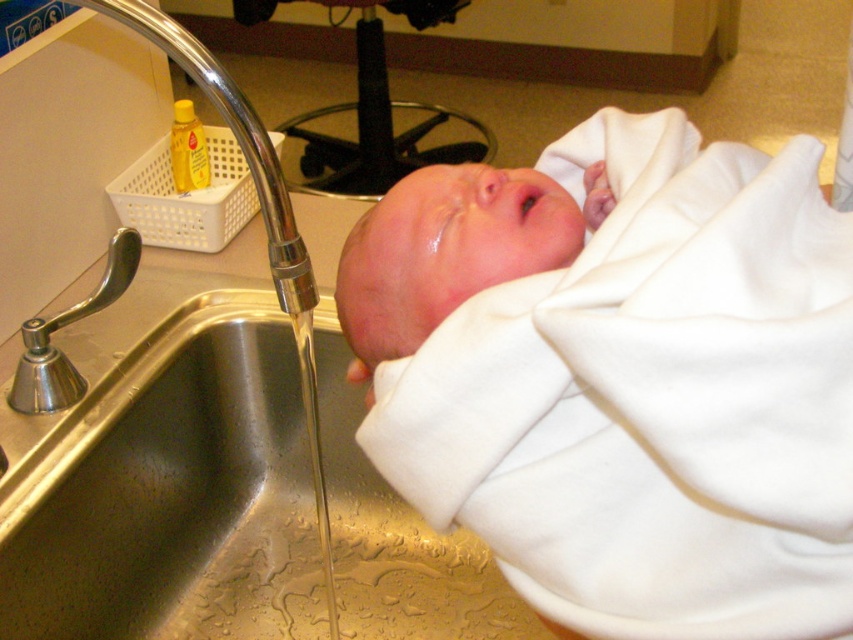
Does white cotton newborn at center have a larger size compared to clear liquid water at sink left?

Indeed, white cotton newborn at center has a larger size compared to clear liquid water at sink left.

Which is in front, point (456, 216) or point (308, 346)?

Point (456, 216) is more forward.

Identify the location of white cotton newborn at center. The image size is (853, 640). (622, 376).

Find the location of a particular element. chrome/metallic faucet at left is located at coordinates (62, 326).

Between chrome/metallic faucet at left and clear liquid water at sink left, which one is positioned lower?

Positioned lower is clear liquid water at sink left.

The height and width of the screenshot is (640, 853). Describe the element at coordinates (62, 326) in the screenshot. I see `chrome/metallic faucet at left` at that location.

Where is `chrome/metallic faucet at left`? The width and height of the screenshot is (853, 640). chrome/metallic faucet at left is located at coordinates click(x=62, y=326).

Does stainless steel sink at center come in front of clear liquid water at sink left?

Yes, it is in front of clear liquid water at sink left.

Is point (178, 38) positioned before point (305, 387)?

Yes, point (178, 38) is closer to viewer.

The width and height of the screenshot is (853, 640). What are the coordinates of `stainless steel sink at center` in the screenshot? It's located at (236, 141).